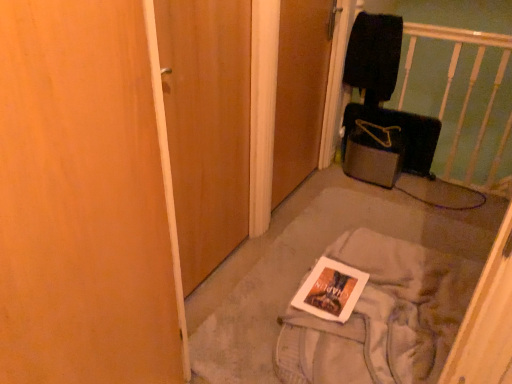
The width and height of the screenshot is (512, 384). Find the location of `free space to the back side of white paper at center`. free space to the back side of white paper at center is located at coordinates (357, 228).